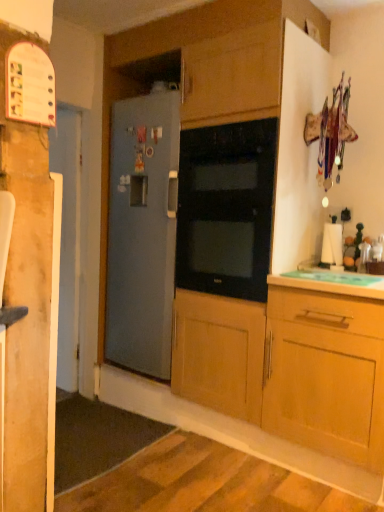
Question: From the image's perspective, is satin gray refrigerator at center positioned above or below green plastic cutting board at lower right?

Choices:
 (A) above
 (B) below

Answer: (A)

Question: Based on their sizes in the image, would you say satin gray refrigerator at center is bigger or smaller than green plastic cutting board at lower right?

Choices:
 (A) small
 (B) big

Answer: (B)

Question: Which object is the farthest from the satin gray refrigerator at center?

Choices:
 (A) black glass oven at center
 (B) white glossy door at left
 (C) green plastic cutting board at lower right

Answer: (C)

Question: Which object is positioned farthest from the black glass oven at center?

Choices:
 (A) green plastic cutting board at lower right
 (B) white glossy door at left
 (C) satin gray refrigerator at center

Answer: (B)